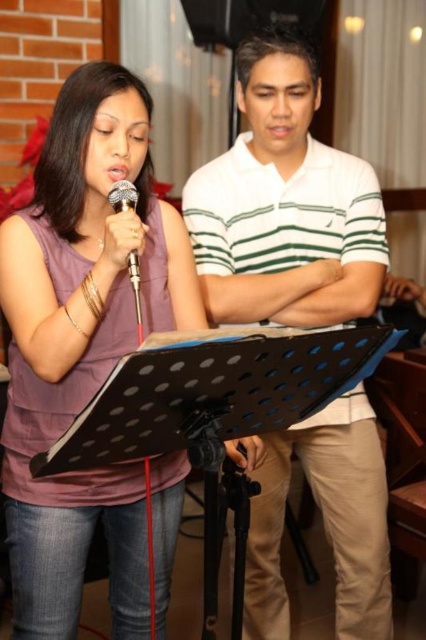
You are an event planner setting up a stage for a performance. You need to ensure that the white striped polo shirt at center and the metallic silver microphone at center are visible to the audience. Based on their positions, which object is closer to the audience side of the stage?

The metallic silver microphone at center is closer to the audience side of the stage because the white striped polo shirt at center is to the right of it, implying the microphone is positioned further forward.

You are standing in the room and see the point at coordinates (83, 346). What object is this point located on?

The point at coordinates (83, 346) is located on the matte purple shirt at center.

You are standing in the room where the performance is happening. You need to move from the point at coordinates point (19, 445) to the point at coordinates point (226, 308). Is the destination point behind or in front of your starting position?

The destination point at coordinates point (226, 308) is behind the starting point at coordinates point (19, 445) because the starting point is in front of the destination point according to the spatial relationship provided.